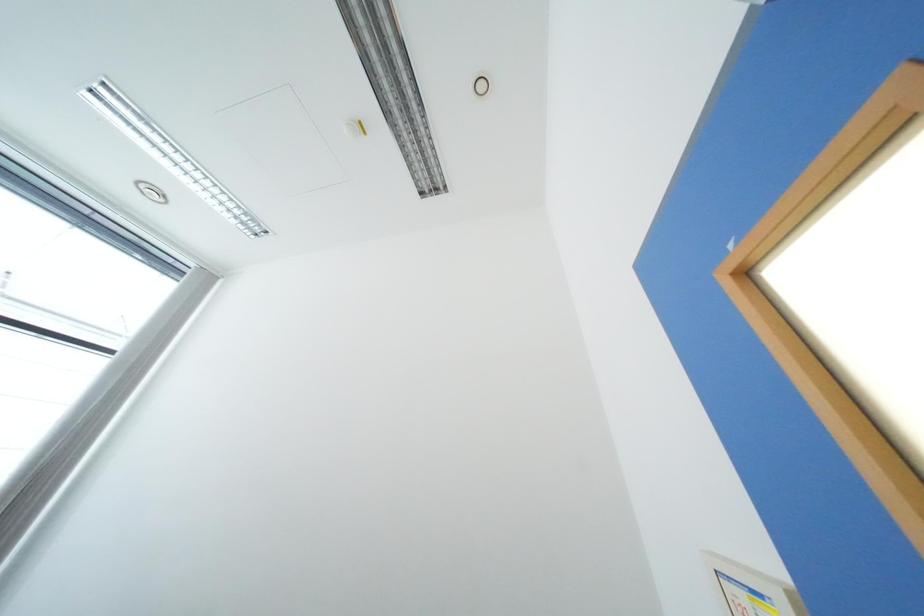
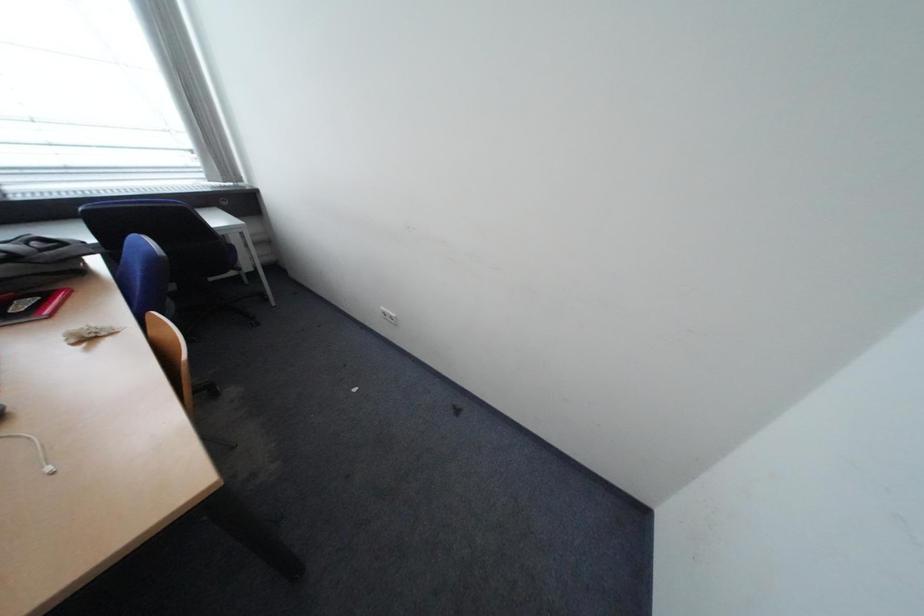
From the picture: The images are taken continuously from a first-person perspective. In which direction is your viewpoint rotating?

The camera rotated toward left-down.